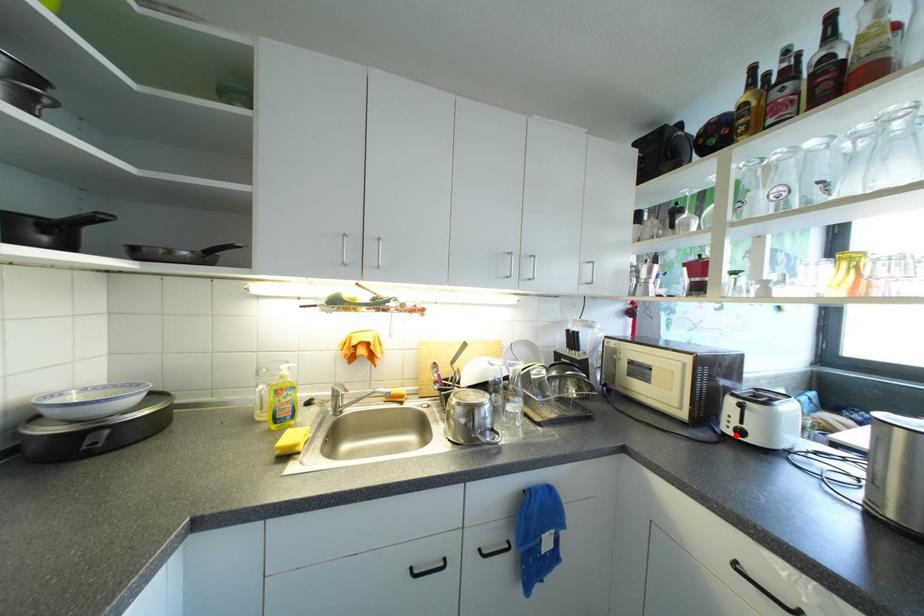
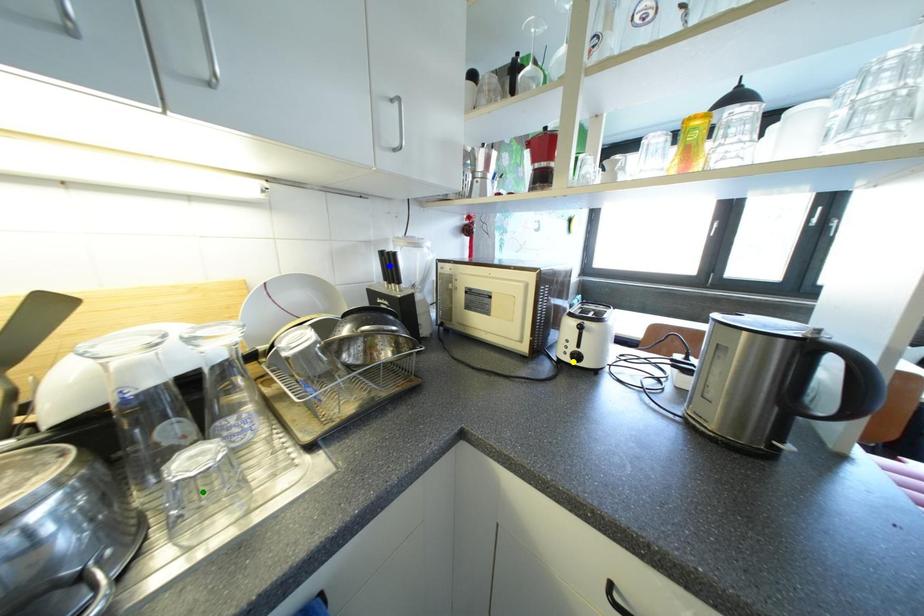
Question: I am providing you with two images of the same scene from different viewpoints. A red point is marked on the first image. You are given multiple points on the second image. Which spot in image 2 lines up with the point in image 1?

Choices:
 (A) blue point
 (B) yellow point
 (C) green point

Answer: (B)